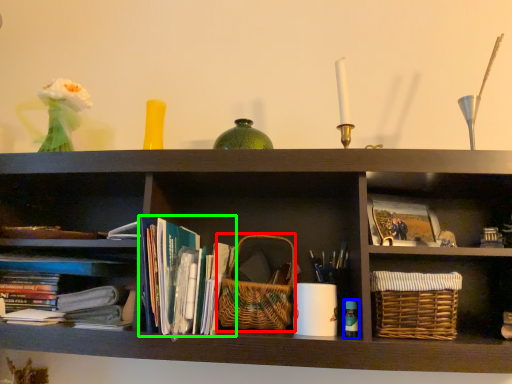
Question: Which object is positioned closest to basket (highlighted by a red box)? Select from bottle (highlighted by a blue box) and book (highlighted by a green box).

Choices:
 (A) bottle
 (B) book

Answer: (B)